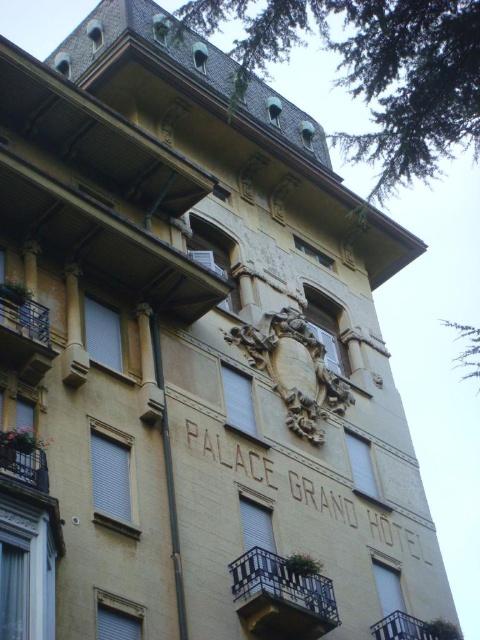
You are standing in front of the Palace Grand Hotel and want to locate the metallic blue balcony at left. Based on the 2D coordinates provided, where should you look relative to the hotel name?

The metallic blue balcony at left is located at the coordinates 0.516 on the x axis and 0.050 on the y axis, which places it to the upper left side of the hotel name.

You are standing in front of the Palace Grand Hotel and want to take a closer look at the ornate sculptural relief above the hotel name. Which of the two balconies, the rustic wrought iron balcony at center or the rustic wrought iron balcony at lower left, is closer to you as you face the building?

The rustic wrought iron balcony at center is closer to you as you face the building because it is further to the viewer than the rustic wrought iron balcony at lower left, meaning it appears nearer in the image.

You are a guest staying at the Palace Grand Hotel and want to enjoy the view from your balcony. You have a 1.8 meters tall potted plant that you want to place on your balcony. Which balcony, the rustic wrought iron balcony at center or the rustic wrought iron balcony at lower left, can safely accommodate the plant without it exceeding the balcony height?

The rustic wrought iron balcony at center is taller than the rustic wrought iron balcony at lower left. Therefore, the 1.8 meters tall potted plant can be safely placed on the rustic wrought iron balcony at center as it is taller and can accommodate the plant without exceeding its height.